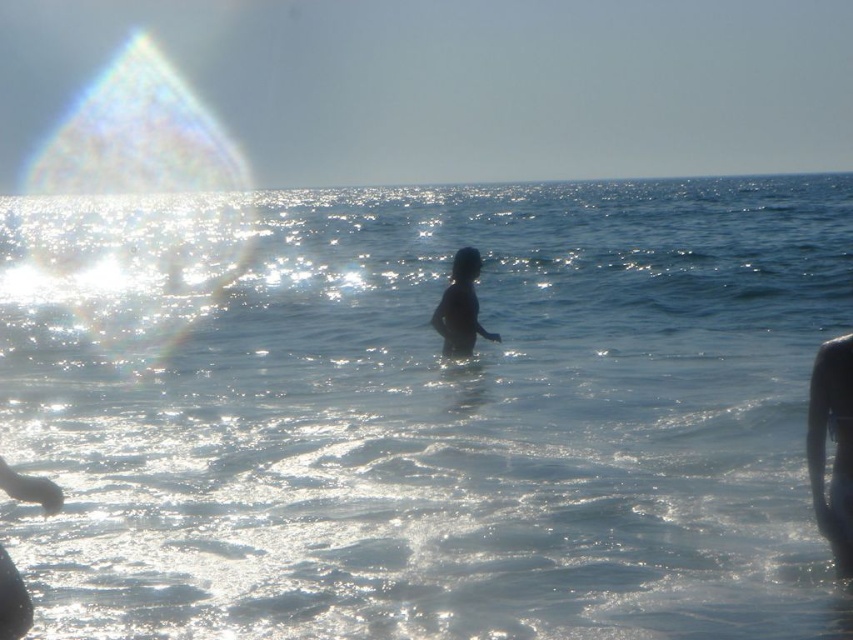
Question: Among these objects, which one is nearest to the camera?

Choices:
 (A) silhouette skin at center
 (B) transparent wet skin at center

Answer: (B)

Question: Can you confirm if transparent wet skin at center is positioned below silhouette skin at center?

Choices:
 (A) yes
 (B) no

Answer: (A)

Question: Does transparent wet skin at center appear over silhouette skin at center?

Choices:
 (A) no
 (B) yes

Answer: (A)

Question: Which of these objects is positioned farthest from the clear water at center?

Choices:
 (A) transparent wet skin at center
 (B) silhouette skin at center

Answer: (A)

Question: Estimate the real-world distances between objects in this image. Which object is closer to the clear water at center?

Choices:
 (A) transparent wet skin at center
 (B) silhouette skin at center

Answer: (B)

Question: Can you confirm if transparent wet skin at center is positioned to the left of silhouette skin at center?

Choices:
 (A) no
 (B) yes

Answer: (A)